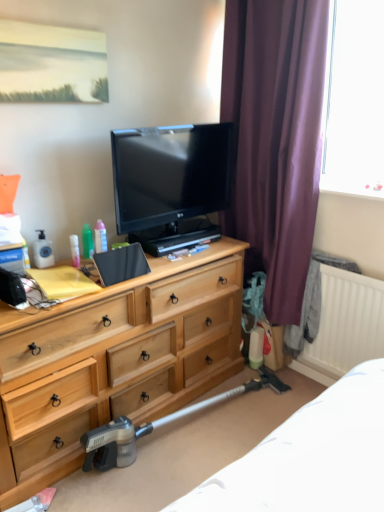
Where is `vacant space underneath metallic gray vacuum cleaner at lower center (from a real-world perspective)`? vacant space underneath metallic gray vacuum cleaner at lower center (from a real-world perspective) is located at coordinates (188, 432).